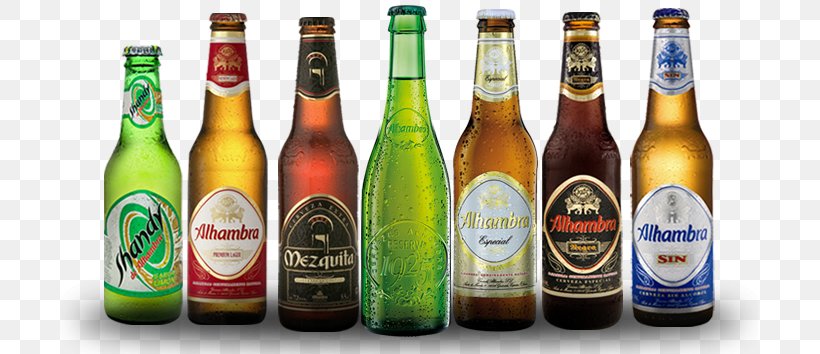
Locate an element on the screen. The width and height of the screenshot is (820, 354). bottles of beer is located at coordinates (152, 231), (219, 234), (325, 231), (413, 233), (479, 229), (581, 230), (667, 229).